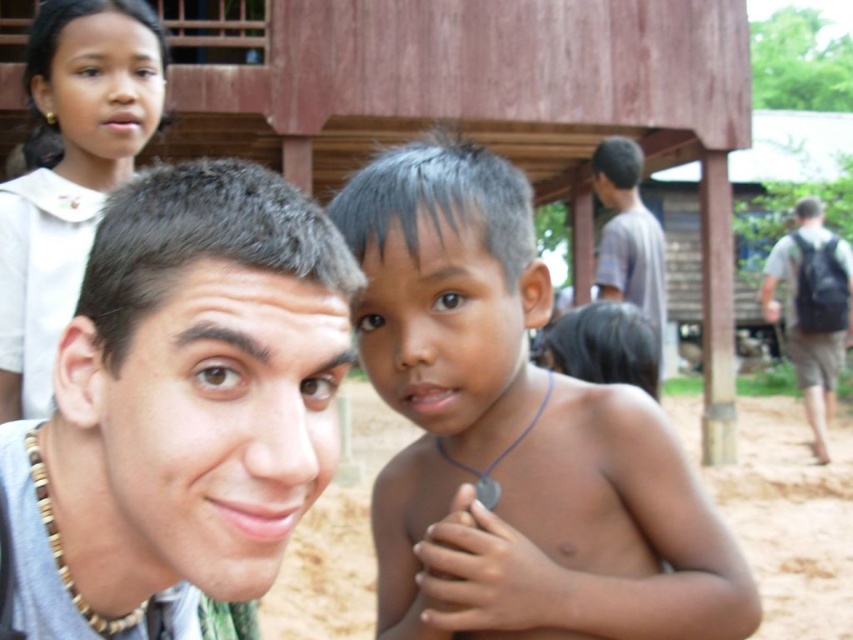
Question: Which object appears farthest from the camera in this image?

Choices:
 (A) brown skin/smooth skin/child at center
 (B) light brown hair at center
 (C) black backpack at right

Answer: (C)

Question: Can you confirm if brown skin/smooth skin/child at center is positioned to the right of light brown hair at center?

Choices:
 (A) yes
 (B) no

Answer: (A)

Question: Based on their relative distances, which object is nearer to the black backpack at right?

Choices:
 (A) brown skin/smooth skin/child at center
 (B) white satin shirt at upper left

Answer: (B)

Question: Is brown skin/smooth skin/child at center closer to the viewer compared to black backpack at right?

Choices:
 (A) yes
 (B) no

Answer: (A)

Question: Which object is closer to the camera taking this photo?

Choices:
 (A) brown skin/smooth skin/child at center
 (B) light brown hair at center

Answer: (B)

Question: Is brown skin/smooth skin/child at center positioned at the back of white satin shirt at upper left?

Choices:
 (A) yes
 (B) no

Answer: (B)